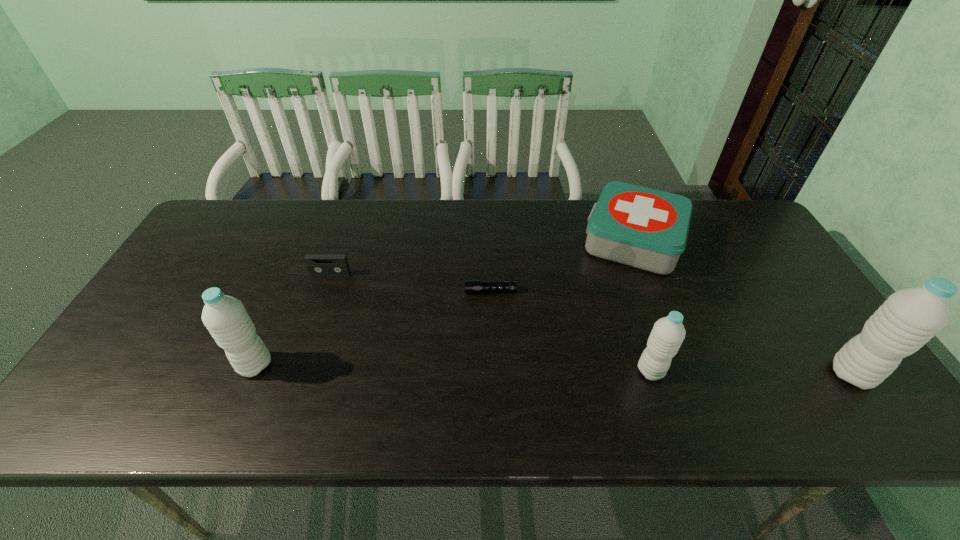
Find the location of a particular element. The height and width of the screenshot is (540, 960). water bottle object that ranks as the second closest to the leftmost water bottle is located at coordinates (909, 318).

Choose which water bottle is the nearest neighbor to the rightmost water bottle. Please provide its 2D coordinates. Your answer should be formatted as a tuple, i.e. [(x, y)], where the tuple contains the x and y coordinates of a point satisfying the conditions above.

[(668, 333)]

This screenshot has width=960, height=540. Identify the location of vacant position in the image that satisfies the following two spatial constraints: 1. on the front side of the shortest water bottle; 2. on the left side of the rightmost water bottle. (652, 374).

You are a GUI agent. You are given a task and a screenshot of the screen. Output one action in this format:
    pyautogui.click(x=<x>, y=<y>)
    Task: Click on the free space that satisfies the following two spatial constraints: 1. at the lens end of the tallest water bottle; 2. on the right side of the shortest object
    Image resolution: width=960 pixels, height=540 pixels.
    Given the screenshot: What is the action you would take?
    pyautogui.click(x=492, y=374)

I want to click on free point that satisfies the following two spatial constraints: 1. at the lens end of the tallest object; 2. on the left side of the third object from left to right, so click(492, 374).

Locate an element on the screen. The image size is (960, 540). vacant space that satisfies the following two spatial constraints: 1. on the front-facing side of the shortest water bottle; 2. on the right side of the videotape is located at coordinates (298, 371).